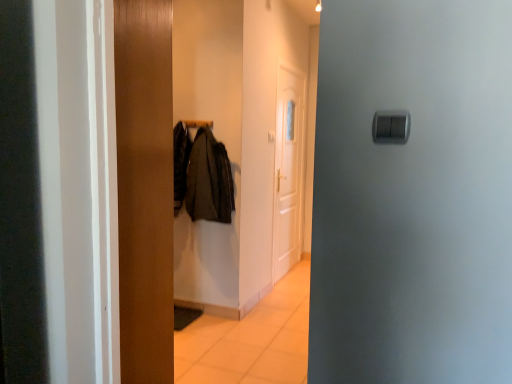
Measure the distance between point (x=296, y=228) and camera.

They are 4.70 meters apart.

Identify the location of white glossy door at center, positioned as the first door in back-to-front order. The height and width of the screenshot is (384, 512). (288, 170).

Measure the distance between point (147, 7) and camera.

Point (147, 7) and camera are 1.90 meters apart from each other.

The height and width of the screenshot is (384, 512). What do you see at coordinates (145, 188) in the screenshot? I see `wooden door at center, positioned as the second door in back-to-front order` at bounding box center [145, 188].

What do you see at coordinates (218, 139) in the screenshot? The height and width of the screenshot is (384, 512). I see `wooden coat rack at center` at bounding box center [218, 139].

At what (x,y) coordinates should I click in order to perform the action: click on metallic coat hanger at center. Please return your answer as a coordinate pair (x, y). The image size is (512, 384). Looking at the image, I should click on (198, 123).

Is metallic coat hanger at center thinner than wooden door at center, which is counted as the 1th door, starting from the left?

Correct, the width of metallic coat hanger at center is less than that of wooden door at center, which is counted as the 1th door, starting from the left.

From the image's perspective, is metallic coat hanger at center below wooden door at center, arranged as the 2th door when viewed from the right?

Incorrect, from the image's perspective, metallic coat hanger at center is higher than wooden door at center, arranged as the 2th door when viewed from the right.

You are a GUI agent. You are given a task and a screenshot of the screen. Output one action in this format:
    pyautogui.click(x=<x>, y=<y>)
    Task: Click on the 2nd door below the metallic coat hanger at center (from the image's perspective)
    Image resolution: width=512 pixels, height=384 pixels.
    Given the screenshot: What is the action you would take?
    pyautogui.click(x=145, y=188)

From a real-world perspective, is metallic coat hanger at center above or below wooden door at center, which is the 1th door from front to back?

In terms of real-world spatial position, metallic coat hanger at center is above wooden door at center, which is the 1th door from front to back.

Does metallic coat hanger at center come in front of white glossy door at center, placed as the second door when sorted from left to right?

That is True.

Is metallic coat hanger at center placed right next to white glossy door at center, positioned as the first door in back-to-front order?

There is a gap between metallic coat hanger at center and white glossy door at center, positioned as the first door in back-to-front order.

Is metallic coat hanger at center shorter than white glossy door at center, positioned as the first door in back-to-front order?

Indeed, metallic coat hanger at center has a lesser height compared to white glossy door at center, positioned as the first door in back-to-front order.

Considering the relative sizes of metallic coat hanger at center and white glossy door at center, placed as the second door when sorted from left to right, in the image provided, is metallic coat hanger at center thinner than white glossy door at center, placed as the second door when sorted from left to right,?

No, metallic coat hanger at center is not thinner than white glossy door at center, placed as the second door when sorted from left to right.

From the image's perspective, is metallic coat hanger at center positioned above or below dark gray fabric coat at center?

Based on their image positions, metallic coat hanger at center is located above dark gray fabric coat at center.

Which is more to the right, metallic coat hanger at center or dark gray fabric coat at center?

Answer: dark gray fabric coat at center.

Considering the relative sizes of metallic coat hanger at center and dark gray fabric coat at center in the image provided, is metallic coat hanger at center bigger than dark gray fabric coat at center?

Incorrect, metallic coat hanger at center is not larger than dark gray fabric coat at center.

From a real-world perspective, is metallic coat hanger at center physically below dark gray fabric coat at center?

Actually, metallic coat hanger at center is physically above dark gray fabric coat at center in the real world.

How much distance is there between wooden coat rack at center and dark gray fabric coat at center?

The distance of wooden coat rack at center from dark gray fabric coat at center is 42.52 centimeters.

Can you confirm if wooden coat rack at center is taller than dark gray fabric coat at center?

Yes.

Does wooden coat rack at center have a greater width compared to dark gray fabric coat at center?

Yes, wooden coat rack at center is wider than dark gray fabric coat at center.

Considering the relative sizes of wooden coat rack at center and dark gray fabric coat at center in the image provided, is wooden coat rack at center bigger than dark gray fabric coat at center?

Indeed, wooden coat rack at center has a larger size compared to dark gray fabric coat at center.

From the image's perspective, relative to white glossy door at center, positioned as the first door in back-to-front order, is dark gray fabric coat at center above or below?

From the image's perspective, dark gray fabric coat at center appears below white glossy door at center, positioned as the first door in back-to-front order.

Which of these two, dark gray fabric coat at center or white glossy door at center, positioned as the first door in back-to-front order, stands taller?

With more height is white glossy door at center, positioned as the first door in back-to-front order.

Is white glossy door at center, positioned as the first door in back-to-front order, at the back of dark gray fabric coat at center?

Yes, dark gray fabric coat at center is positioned with its back facing white glossy door at center, positioned as the first door in back-to-front order.

Can you confirm if dark gray fabric coat at center is bigger than white glossy door at center, positioned as the first door in back-to-front order?

No, dark gray fabric coat at center is not bigger than white glossy door at center, positioned as the first door in back-to-front order.

Would you say wooden door at center, positioned as the second door in back-to-front order, is outside metallic coat hanger at center?

Yes, wooden door at center, positioned as the second door in back-to-front order, is outside of metallic coat hanger at center.

From the image's perspective, which is below, wooden door at center, which is counted as the 1th door, starting from the left, or metallic coat hanger at center?

wooden door at center, which is counted as the 1th door, starting from the left.

Between wooden door at center, which is the 1th door from front to back, and metallic coat hanger at center, which one has less height?

With less height is metallic coat hanger at center.

Is there a large distance between wooden door at center, arranged as the 2th door when viewed from the right, and metallic coat hanger at center?

Yes, wooden door at center, arranged as the 2th door when viewed from the right, and metallic coat hanger at center are located far from each other.

Is metallic coat hanger at center situated inside wooden coat rack at center or outside?

metallic coat hanger at center is not enclosed by wooden coat rack at center.

Is metallic coat hanger at center taller or shorter than wooden coat rack at center?

In the image, metallic coat hanger at center appears to be shorter than wooden coat rack at center.

Is metallic coat hanger at center next to wooden coat rack at center and touching it?

No, metallic coat hanger at center is not with wooden coat rack at center.

Does metallic coat hanger at center turn towards wooden coat rack at center?

No, metallic coat hanger at center is not facing towards wooden coat rack at center.

What are the coordinates of `door that appears in front of the metallic coat hanger at center` in the screenshot? It's located at (145, 188).

You are a GUI agent. You are given a task and a screenshot of the screen. Output one action in this format:
    pyautogui.click(x=<x>, y=<y>)
    Task: Click on the hanger that is on the left side of white glossy door at center, which appears as the first door when viewed from the right
    This screenshot has width=512, height=384.
    Given the screenshot: What is the action you would take?
    pyautogui.click(x=198, y=123)

Based on the photo, looking at the image, which one is located closer to wooden coat rack at center, white glossy door at center, placed as the second door when sorted from left to right, or dark gray fabric coat at center?

white glossy door at center, placed as the second door when sorted from left to right, is positioned closer to the anchor wooden coat rack at center.

Based on the photo, which object lies nearer to the anchor point white glossy door at center, which appears as the second door when viewed from the front, wooden door at center, which is the 1th door from front to back, or wooden coat rack at center?

wooden coat rack at center.

Considering their positions, is dark gray fabric coat at center positioned further to wooden coat rack at center than white glossy door at center, placed as the second door when sorted from left to right?

Among the two, dark gray fabric coat at center is located further to wooden coat rack at center.

From the image, which object appears to be nearer to wooden door at center, which is counted as the 1th door, starting from the left, white glossy door at center, which appears as the first door when viewed from the right, or wooden coat rack at center?

wooden coat rack at center.

From the picture: Considering their positions, is metallic coat hanger at center positioned closer to dark gray fabric coat at center than wooden coat rack at center?

Based on the image, metallic coat hanger at center appears to be nearer to dark gray fabric coat at center.

Estimate the real-world distances between objects in this image. Which object is further from wooden coat rack at center, wooden door at center, which is the 1th door from front to back, or white glossy door at center, which appears as the first door when viewed from the right?

wooden door at center, which is the 1th door from front to back, lies further to wooden coat rack at center than the other object.

Based on the photo, when comparing their distances from wooden door at center, arranged as the 2th door when viewed from the right, does white glossy door at center, which appears as the first door when viewed from the right, or dark gray fabric coat at center seem further?

Based on the image, white glossy door at center, which appears as the first door when viewed from the right, appears to be further to wooden door at center, arranged as the 2th door when viewed from the right.

Looking at the image, which one is located further to wooden coat rack at center, metallic coat hanger at center or wooden door at center, arranged as the 2th door when viewed from the right?

wooden door at center, arranged as the 2th door when viewed from the right.

This screenshot has width=512, height=384. I want to click on door between wooden coat rack at center and dark gray fabric coat at center along the z-axis, so click(145, 188).

Identify the location of clothing positioned between wooden door at center, which is the 1th door from front to back, and white glossy door at center, which appears as the second door when viewed from the front, from near to far. (209, 180).

Find the location of `clothing between wooden door at center, arranged as the 2th door when viewed from the right, and metallic coat hanger at center, along the z-axis`. clothing between wooden door at center, arranged as the 2th door when viewed from the right, and metallic coat hanger at center, along the z-axis is located at coordinates (209, 180).

Where is `clothing located between wooden coat rack at center and metallic coat hanger at center in the depth direction`? clothing located between wooden coat rack at center and metallic coat hanger at center in the depth direction is located at coordinates (209, 180).